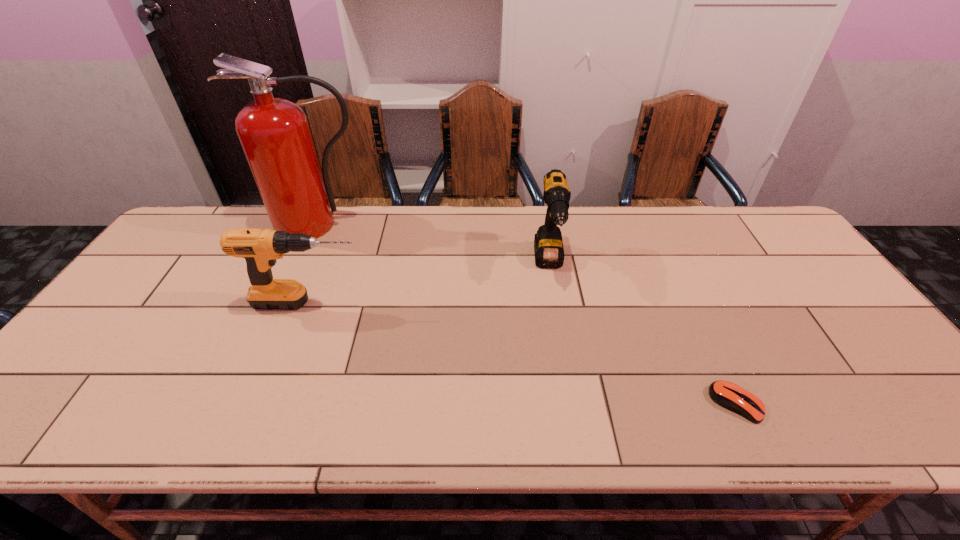
The height and width of the screenshot is (540, 960). In order to click on free spot that satisfies the following two spatial constraints: 1. at the tip of the second object from right to left; 2. at the tip of the second nearest object in this screenshot , I will do `click(556, 303)`.

The image size is (960, 540). Find the location of `vacant space that satisfies the following two spatial constraints: 1. at the tip of the nearer drill; 2. on the left side of the computer mouse`. vacant space that satisfies the following two spatial constraints: 1. at the tip of the nearer drill; 2. on the left side of the computer mouse is located at coordinates (270, 403).

Find the location of a particular element. vacant space that satisfies the following two spatial constraints: 1. with the handle and nozzle on the nearest object; 2. on the left side of the tallest object is located at coordinates (238, 403).

The height and width of the screenshot is (540, 960). I want to click on vacant point that satisfies the following two spatial constraints: 1. with the handle and nozzle on the tallest object; 2. on the left side of the rightmost object, so click(x=238, y=403).

The width and height of the screenshot is (960, 540). I want to click on vacant space that satisfies the following two spatial constraints: 1. at the tip of the farther drill; 2. on the left side of the computer mouse, so 573,403.

Identify the location of blank area in the image that satisfies the following two spatial constraints: 1. at the tip of the shortest object; 2. on the left side of the third farthest object. This screenshot has height=540, width=960. (270, 403).

This screenshot has width=960, height=540. What are the coordinates of `free space that satisfies the following two spatial constraints: 1. at the tip of the farther drill; 2. at the tip of the second nearest object` in the screenshot? It's located at (556, 303).

Locate an element on the screen. vacant space that satisfies the following two spatial constraints: 1. at the tip of the right drill; 2. on the left side of the nearest object is located at coordinates (573, 403).

Image resolution: width=960 pixels, height=540 pixels. Find the location of `vacant space that satisfies the following two spatial constraints: 1. at the tip of the nearest object; 2. on the left side of the nearer drill`. vacant space that satisfies the following two spatial constraints: 1. at the tip of the nearest object; 2. on the left side of the nearer drill is located at coordinates (270, 403).

I want to click on vacant point that satisfies the following two spatial constraints: 1. at the tip of the nearest object; 2. on the right side of the nearer drill, so click(270, 403).